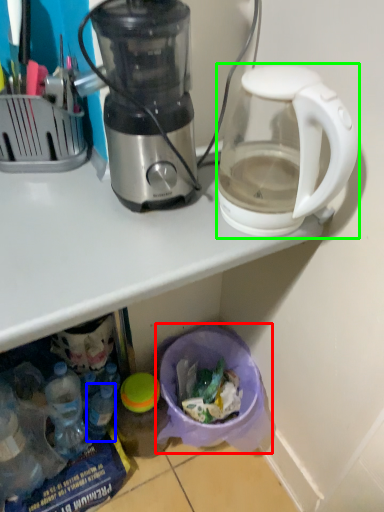
Question: Which object is the farthest from garbage (highlighted by a red box)? Choose among these: bottle (highlighted by a blue box) or coffee maker (highlighted by a green box).

Choices:
 (A) bottle
 (B) coffee maker

Answer: (B)